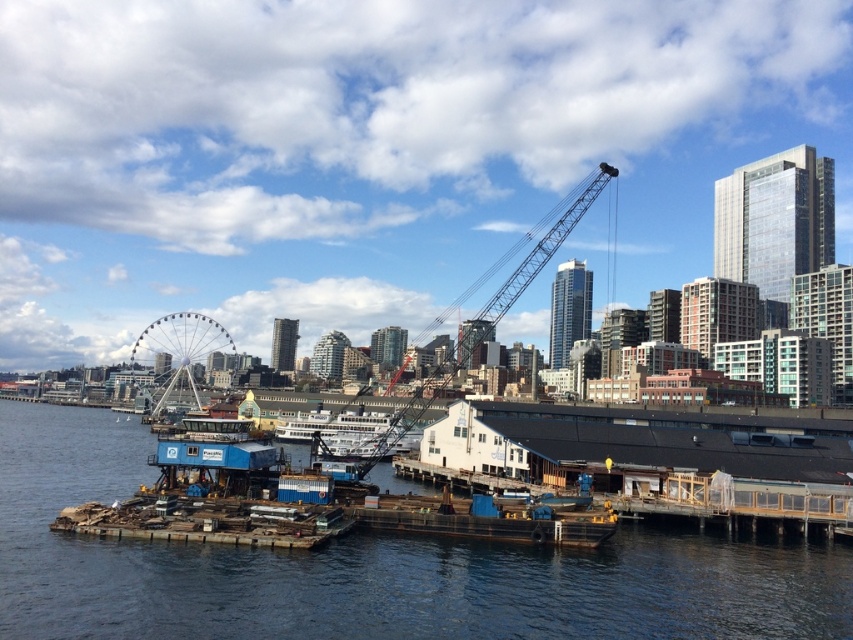
Can you confirm if metallic gray crane at center is smaller than white metallic ferris wheel at left?

Incorrect, metallic gray crane at center is not smaller in size than white metallic ferris wheel at left.

Does metallic gray crane at center appear under white metallic ferris wheel at left?

No, metallic gray crane at center is not below white metallic ferris wheel at left.

Is point (460, 348) closer to viewer compared to point (135, 348)?

No, (460, 348) is behind (135, 348).

In order to click on metallic gray crane at center in this screenshot , I will do `click(485, 321)`.

Does white metallic ferris wheel at left lie behind white matte ferry at center?

That is True.

At what (x,y) coordinates should I click in order to perform the action: click on white metallic ferris wheel at left. Please return your answer as a coordinate pair (x, y). Looking at the image, I should click on (178, 360).

You are a GUI agent. You are given a task and a screenshot of the screen. Output one action in this format:
    pyautogui.click(x=<x>, y=<y>)
    Task: Click on the white metallic ferris wheel at left
    This screenshot has height=640, width=853.
    Given the screenshot: What is the action you would take?
    pyautogui.click(x=178, y=360)

In the scene shown: Does brown wooden dock at center have a lesser width compared to metallic gray crane at center?

Yes.

Can you confirm if brown wooden dock at center is positioned below metallic gray crane at center?

Yes.

Does point (12, 556) come farther from viewer compared to point (467, 336)?

No, (12, 556) is closer to viewer.

At what (x,y) coordinates should I click in order to perform the action: click on brown wooden dock at center. Please return your answer as a coordinate pair (x, y). The width and height of the screenshot is (853, 640). Looking at the image, I should click on (369, 568).